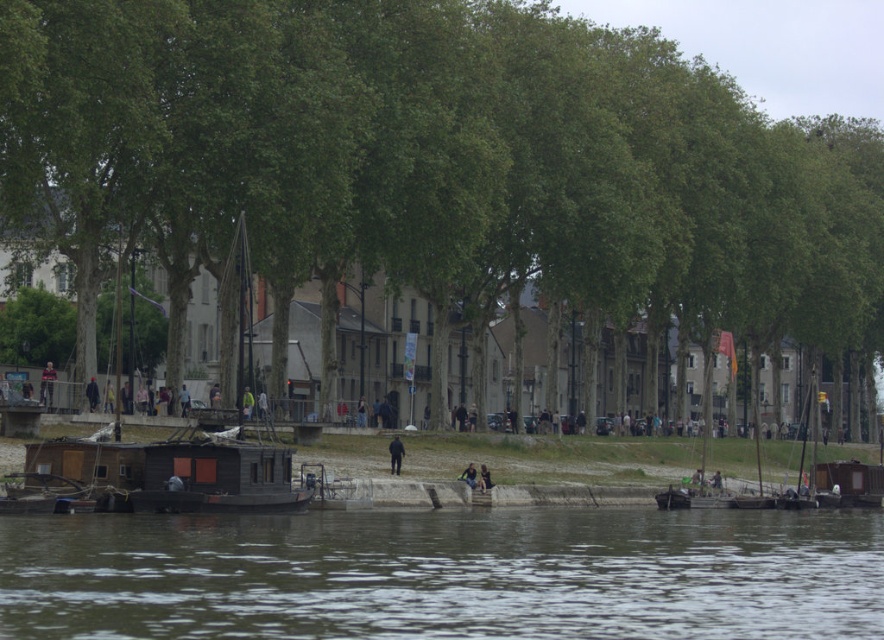
Question: Which of these objects is positioned closest to the dark gray fabric jacket at center?

Choices:
 (A) brown water at lower center
 (B) yellow fabric person at center

Answer: (B)

Question: Considering the real-world distances, which object is closest to the yellow fabric person at center?

Choices:
 (A) black matte pants at center
 (B) green fabric jacket at center
 (C) dark brown wooden boat at center
 (D) green leafy tree at center

Answer: (A)

Question: Which object appears farthest from the camera in this image?

Choices:
 (A) yellow fabric person at center
 (B) green leafy tree at center
 (C) dark brown wooden boat at center
 (D) wooden boat at left

Answer: (A)

Question: From the image, what is the correct spatial relationship of brown water at lower center in relation to green fabric jacket at center?

Choices:
 (A) above
 (B) below

Answer: (B)

Question: Does dark brown wooden boat at center appear on the right side of dark gray fabric jacket at center?

Choices:
 (A) yes
 (B) no

Answer: (A)

Question: From the image, what is the correct spatial relationship of dark brown wooden boat at center in relation to yellow fabric person at center?

Choices:
 (A) left
 (B) right

Answer: (B)